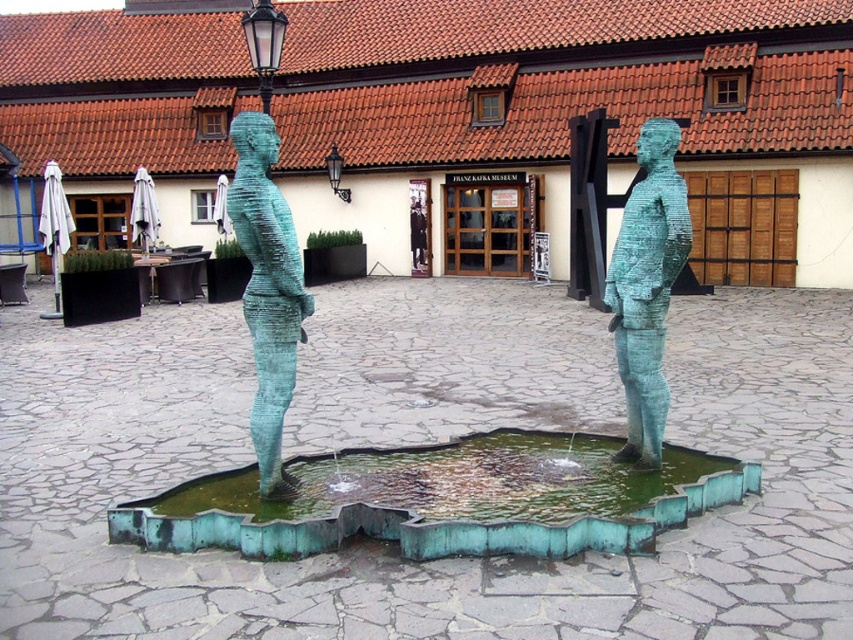
Question: Can you confirm if green patina water at center is positioned above green patina lamp post at upper center?

Choices:
 (A) yes
 (B) no

Answer: (B)

Question: Which of the following is the farthest from the observer?

Choices:
 (A) green patina lamp post at upper center
 (B) green patina statue at center
 (C) green patina water at center
 (D) green patinated bronze statue at center

Answer: (A)

Question: Which point is farther to the camera?

Choices:
 (A) green patina lamp post at upper center
 (B) green patinated bronze statue at center

Answer: (A)

Question: Observing the image, what is the correct spatial positioning of green patinated bronze statue at center in reference to green patina lamp post at upper center?

Choices:
 (A) left
 (B) right

Answer: (B)

Question: Can you confirm if green patinated bronze statue at center is positioned to the right of green patina lamp post at upper center?

Choices:
 (A) yes
 (B) no

Answer: (A)

Question: Which object appears closest to the camera in this image?

Choices:
 (A) green patina statue at center
 (B) green patina water at center

Answer: (B)